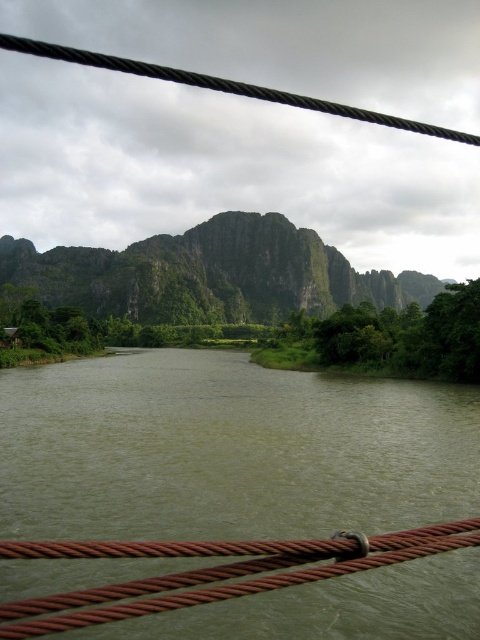
Question: Can you confirm if green murky water at center is positioned above green rocky mountain at center?

Choices:
 (A) no
 (B) yes

Answer: (A)

Question: Does green murky water at center come in front of rusty metal rope bridge at center?

Choices:
 (A) yes
 (B) no

Answer: (B)

Question: Which object is the closest to the green rocky mountain at center?

Choices:
 (A) rusty metal rope bridge at center
 (B) green murky water at center

Answer: (B)

Question: Which object appears closest to the camera in this image?

Choices:
 (A) green rocky mountain at center
 (B) green murky water at center

Answer: (B)

Question: Among these objects, which one is farthest from the camera?

Choices:
 (A) green murky water at center
 (B) green rocky mountain at center

Answer: (B)

Question: Does green murky water at center appear on the right side of rusty metal rope bridge at center?

Choices:
 (A) yes
 (B) no

Answer: (B)